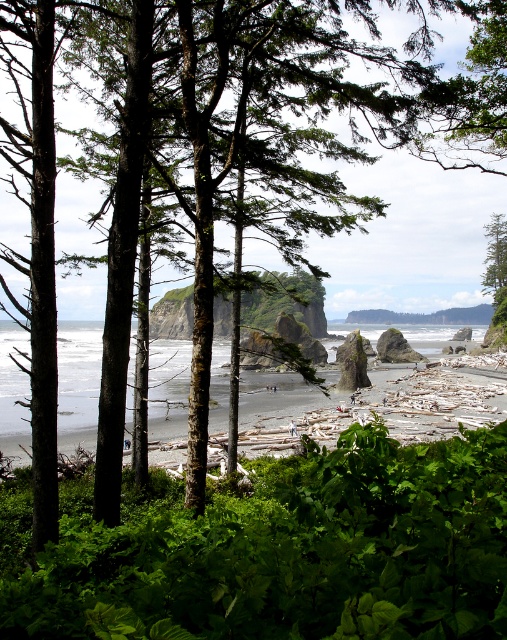
Which is behind, point (301, 458) or point (487, 248)?

The point (487, 248) is behind.

Between green leafy shrubs at center and green rough bark tree at upper right, which one appears on the right side from the viewer's perspective?

green rough bark tree at upper right

Find the location of a particular element. green leafy shrubs at center is located at coordinates (295, 554).